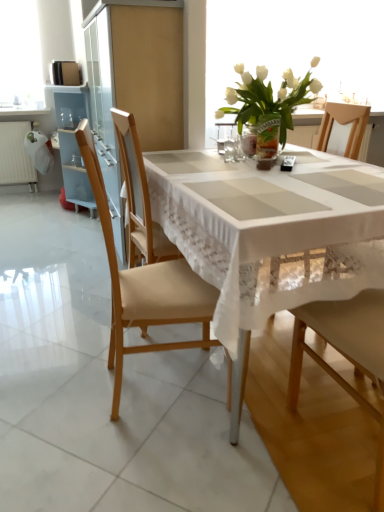
What are the coordinates of `free space to the left of light brown wood chair at left, the first chair when ordered from left to right` in the screenshot? It's located at (58, 381).